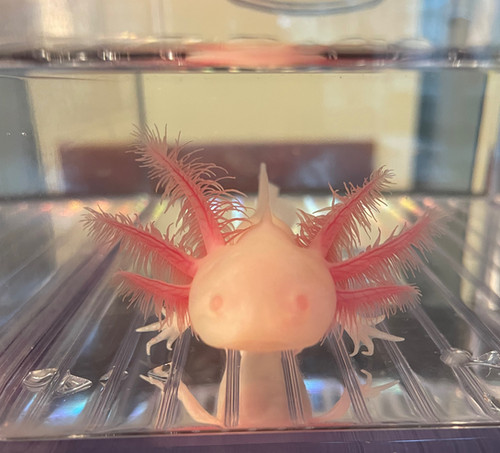
At what (x,y) coordinates should I click in order to perform the action: click on desk. Please return your answer as a coordinate pair (x, y). The image size is (500, 453). Looking at the image, I should click on (234, 164).